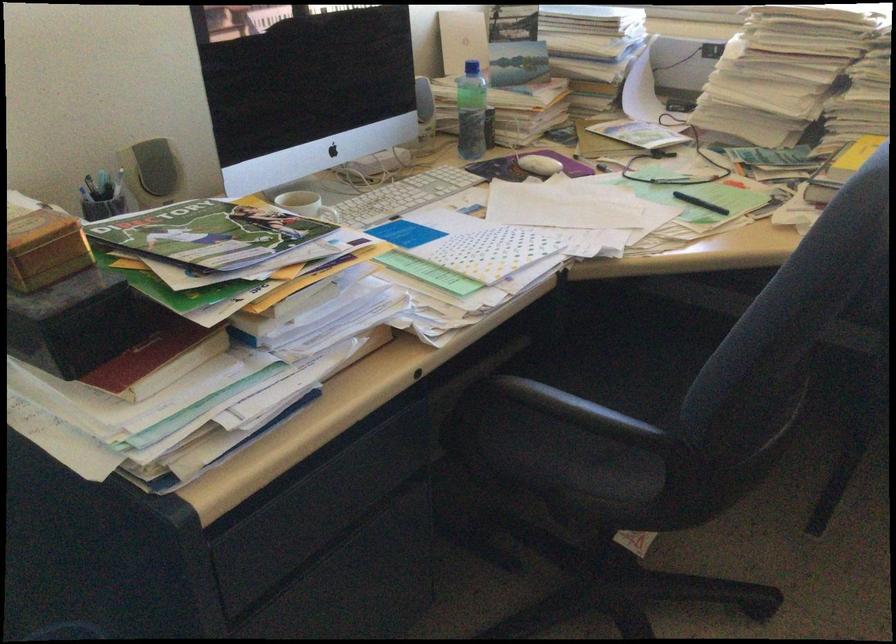
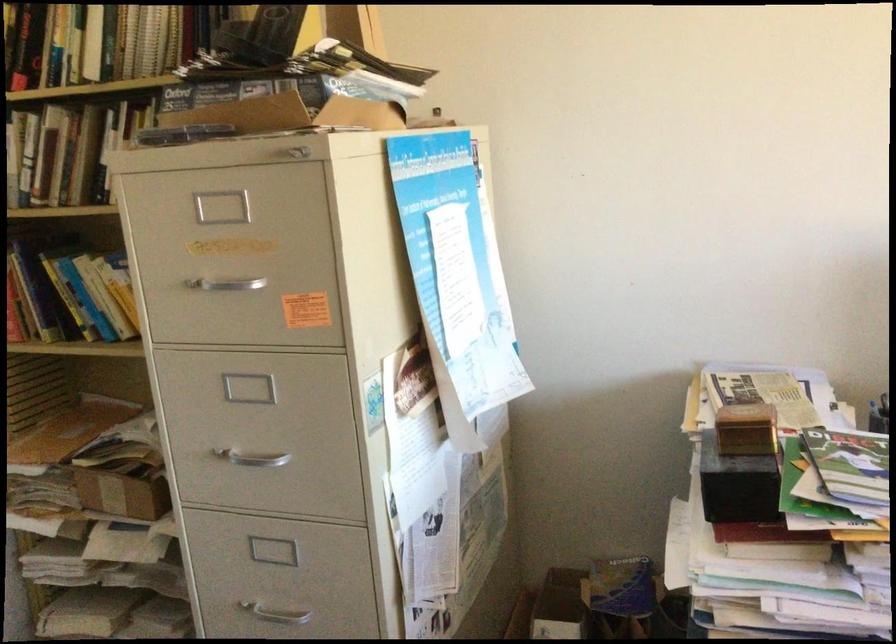
Question: The images are taken continuously from a first-person perspective. In which direction is your viewpoint rotating?

Choices:
 (A) Left
 (B) Right
 (C) Up
 (D) Down

Answer: (A)